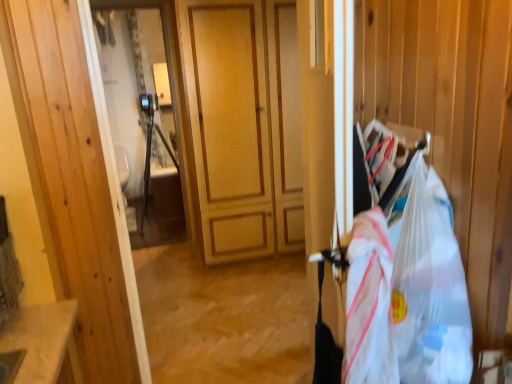
Question: Considering the relative sizes of white plastic bag at right, the 2th grocery bag in the right-to-left sequence, and clear plastic grocery bag at right, the first grocery bag from the right, in the image provided, is white plastic bag at right, the 2th grocery bag in the right-to-left sequence, thinner than clear plastic grocery bag at right, the first grocery bag from the right,?

Choices:
 (A) no
 (B) yes

Answer: (B)

Question: Considering the relative sizes of white plastic bag at right, which is counted as the 1th grocery bag, starting from the left, and clear plastic grocery bag at right, arranged as the 2th grocery bag when viewed from the left, in the image provided, is white plastic bag at right, which is counted as the 1th grocery bag, starting from the left, bigger than clear plastic grocery bag at right, arranged as the 2th grocery bag when viewed from the left,?

Choices:
 (A) no
 (B) yes

Answer: (A)

Question: From a real-world perspective, is white plastic bag at right, which is counted as the 1th grocery bag, starting from the left, below clear plastic grocery bag at right, arranged as the 2th grocery bag when viewed from the left?

Choices:
 (A) yes
 (B) no

Answer: (A)

Question: Is white plastic bag at right, which is counted as the 1th grocery bag, starting from the left, directly adjacent to clear plastic grocery bag at right, arranged as the 2th grocery bag when viewed from the left?

Choices:
 (A) yes
 (B) no

Answer: (A)

Question: Considering the relative positions of white plastic bag at right, the 2th grocery bag in the right-to-left sequence, and clear plastic grocery bag at right, the first grocery bag from the right, in the image provided, is white plastic bag at right, the 2th grocery bag in the right-to-left sequence, in front of clear plastic grocery bag at right, the first grocery bag from the right,?

Choices:
 (A) no
 (B) yes

Answer: (A)

Question: Is white plastic bag at right, the 2th grocery bag in the right-to-left sequence, at the right side of clear plastic grocery bag at right, arranged as the 2th grocery bag when viewed from the left?

Choices:
 (A) no
 (B) yes

Answer: (A)

Question: Does clear plastic grocery bag at right, arranged as the 2th grocery bag when viewed from the left, have a lesser height compared to white plastic bag at right, which is counted as the 1th grocery bag, starting from the left?

Choices:
 (A) no
 (B) yes

Answer: (A)

Question: Is clear plastic grocery bag at right, the first grocery bag from the right, not close to white plastic bag at right, which is counted as the 1th grocery bag, starting from the left?

Choices:
 (A) no
 (B) yes

Answer: (A)

Question: Is the surface of clear plastic grocery bag at right, the first grocery bag from the right, in direct contact with white plastic bag at right, the 2th grocery bag in the right-to-left sequence?

Choices:
 (A) no
 (B) yes

Answer: (B)

Question: Considering the relative sizes of clear plastic grocery bag at right, arranged as the 2th grocery bag when viewed from the left, and white plastic bag at right, which is counted as the 1th grocery bag, starting from the left, in the image provided, is clear plastic grocery bag at right, arranged as the 2th grocery bag when viewed from the left, thinner than white plastic bag at right, which is counted as the 1th grocery bag, starting from the left,?

Choices:
 (A) no
 (B) yes

Answer: (A)

Question: Considering the relative sizes of clear plastic grocery bag at right, arranged as the 2th grocery bag when viewed from the left, and white plastic bag at right, which is counted as the 1th grocery bag, starting from the left, in the image provided, is clear plastic grocery bag at right, arranged as the 2th grocery bag when viewed from the left, smaller than white plastic bag at right, which is counted as the 1th grocery bag, starting from the left,?

Choices:
 (A) no
 (B) yes

Answer: (A)

Question: Does clear plastic grocery bag at right, arranged as the 2th grocery bag when viewed from the left, have a greater width compared to white plastic bag at right, the 2th grocery bag in the right-to-left sequence?

Choices:
 (A) no
 (B) yes

Answer: (B)

Question: In terms of height, does clear plastic grocery bag at right, the first grocery bag from the right, look taller or shorter compared to white plastic bag at right, which is counted as the 1th grocery bag, starting from the left?

Choices:
 (A) tall
 (B) short

Answer: (A)